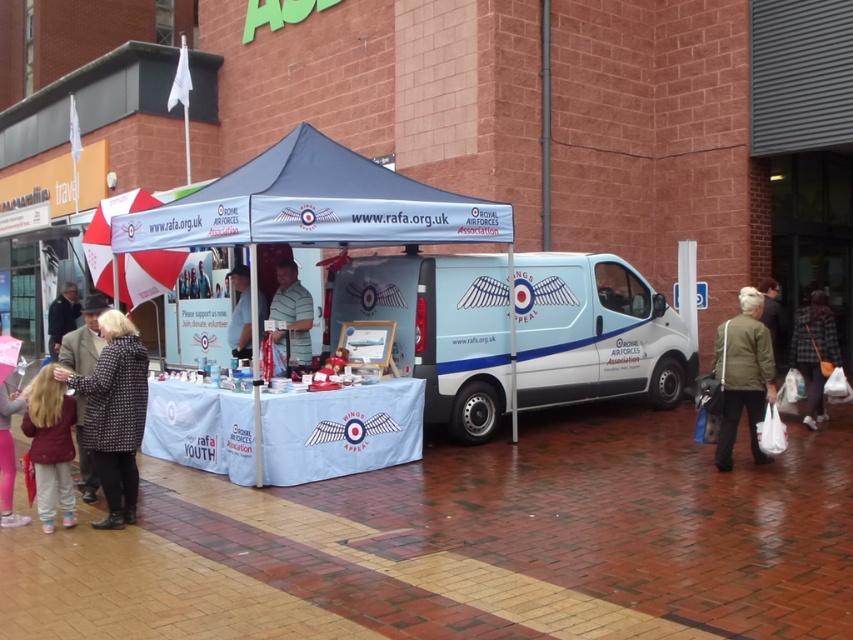
Question: Which object appears farthest from the camera in this image?

Choices:
 (A) light blue fabric at center
 (B) red and white fabric canopy at upper left
 (C) light brown hair at lower left
 (D) white glossy van at center

Answer: (B)

Question: Which point is closer to the camera?

Choices:
 (A) plaid fabric jacket at lower right
 (B) light brown hair at lower left
 (C) blue fabric tent at center
 (D) light blue fabric at center

Answer: (B)

Question: Is patterned coat at center closer to camera compared to light blue fabric at center?

Choices:
 (A) yes
 (B) no

Answer: (A)

Question: Can you confirm if blue fabric tent at center is thinner than blue fabric canopy at center?

Choices:
 (A) no
 (B) yes

Answer: (B)

Question: Which of the following is the farthest from the observer?

Choices:
 (A) blue fabric tent at center
 (B) patterned coat at center
 (C) khaki fabric jacket at lower right
 (D) light blue fabric at center

Answer: (D)

Question: Does blue fabric tent at center appear over plaid fabric jacket at lower right?

Choices:
 (A) no
 (B) yes

Answer: (B)